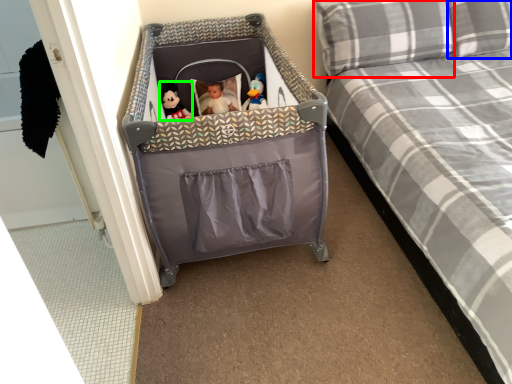
Question: Which object is the farthest from pillow (highlighted by a red box)? Choose among these: pillow (highlighted by a blue box) or doll (highlighted by a green box).

Choices:
 (A) pillow
 (B) doll

Answer: (B)